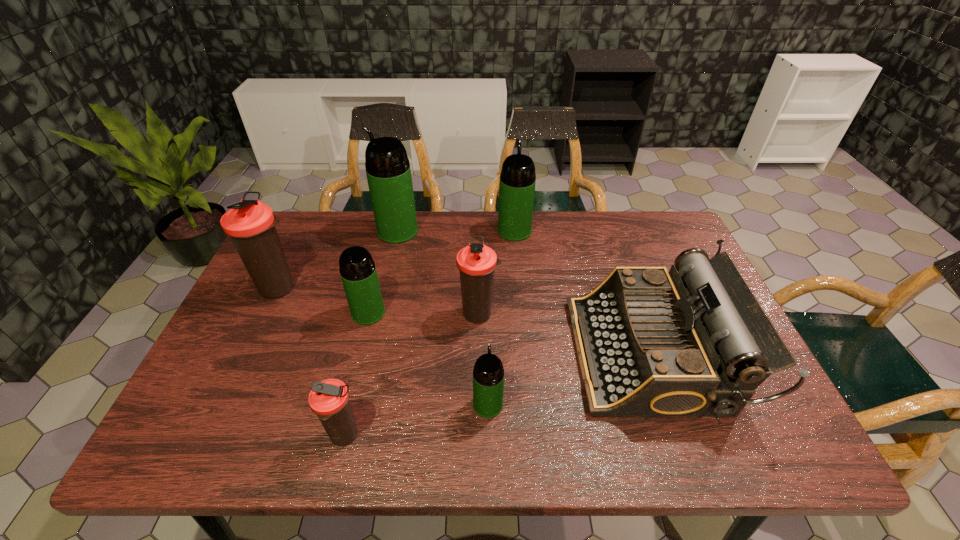
Locate an element on the screen. This screenshot has height=540, width=960. object positioned at the near right corner is located at coordinates (651, 342).

In the image, there is a desktop. Where is `free space at the far edge`? This screenshot has width=960, height=540. free space at the far edge is located at coordinates pos(474,231).

Find the location of a particular element. Image resolution: width=960 pixels, height=540 pixels. blank area at the near edge is located at coordinates tap(599, 449).

In order to click on blank space at the left edge in this screenshot , I will do (243, 364).

At what (x,y) coordinates should I click in order to perform the action: click on vacant space at the far left corner of the desktop. Please return your answer as a coordinate pair (x, y). Looking at the image, I should click on (302, 230).

Locate an element on the screen. free space at the far right corner of the desktop is located at coordinates (x=638, y=215).

The height and width of the screenshot is (540, 960). I want to click on vacant space at the near right corner, so click(757, 426).

I want to click on free spot between the rightmost brown thermos bottle and the tallest thermos bottle, so click(439, 272).

This screenshot has width=960, height=540. I want to click on vacant space that's between the second brown thermos bottle from left to right and the second smallest green thermos bottle, so click(356, 375).

What are the coordinates of `unoccupied area between the second green thermos bottle from right to left and the leftmost thermos bottle` in the screenshot? It's located at (384, 346).